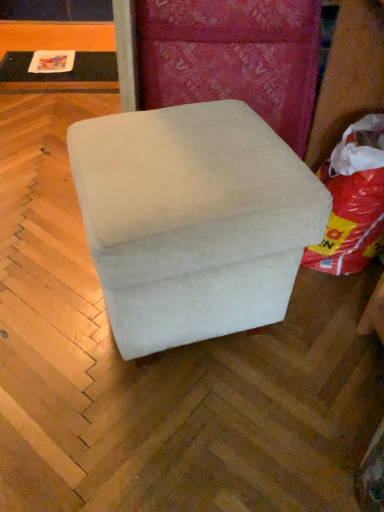
Based on the photo, measure the distance between white fabric ottoman at center and camera.

A distance of 24.57 inches exists between white fabric ottoman at center and camera.

This screenshot has width=384, height=512. Describe the element at coordinates (353, 201) in the screenshot. I see `white fabric bean bag at right` at that location.

Locate an element on the screen. white fabric ottoman at center is located at coordinates (193, 220).

Considering their positions, is matte black table at upper left located in front of or behind white fabric bean bag at right?

Visually, matte black table at upper left is located behind white fabric bean bag at right.

Find the location of a particular element. Image resolution: width=384 pixels, height=512 pixels. bean bag chair in front of the matte black table at upper left is located at coordinates (353, 201).

How different are the orientations of matte black table at upper left and white fabric bean bag at right in degrees?

The facing directions of matte black table at upper left and white fabric bean bag at right are 84 degrees apart.

From a real-world perspective, which is physically below, matte black table at upper left or white fabric bean bag at right?

matte black table at upper left, from a real-world perspective.

Considering the relative positions of matte black table at upper left and white fabric ottoman at center in the image provided, is matte black table at upper left to the right of white fabric ottoman at center from the viewer's perspective?

In fact, matte black table at upper left is to the left of white fabric ottoman at center.

In terms of size, does matte black table at upper left appear bigger or smaller than white fabric ottoman at center?

Clearly, matte black table at upper left is smaller in size than white fabric ottoman at center.

Which of these two, matte black table at upper left or white fabric ottoman at center, stands shorter?

matte black table at upper left is shorter.

Is white fabric ottoman at center inside or outside of white fabric bean bag at right?

white fabric ottoman at center cannot be found inside white fabric bean bag at right.

Considering the sizes of objects white fabric ottoman at center and white fabric bean bag at right in the image provided, who is wider, white fabric ottoman at center or white fabric bean bag at right?

white fabric ottoman at center is wider.

This screenshot has height=512, width=384. I want to click on furniture in front of the white fabric bean bag at right, so click(193, 220).

From a real-world perspective, is white fabric bean bag at right on top of white fabric ottoman at center?

Incorrect, from a real-world perspective, white fabric bean bag at right is lower than white fabric ottoman at center.

I want to click on furniture lying in front of the white fabric bean bag at right, so click(193, 220).

Considering the relative positions of white fabric bean bag at right and white fabric ottoman at center in the image provided, is white fabric bean bag at right to the left of white fabric ottoman at center from the viewer's perspective?

No, white fabric bean bag at right is not to the left of white fabric ottoman at center.

Is white fabric bean bag at right far away from white fabric ottoman at center?

No.

Considering the relative sizes of white fabric ottoman at center and matte black table at upper left in the image provided, is white fabric ottoman at center smaller than matte black table at upper left?

Incorrect, white fabric ottoman at center is not smaller in size than matte black table at upper left.

From a real-world perspective, which is physically above, white fabric ottoman at center or matte black table at upper left?

white fabric ottoman at center.

Considering the relative sizes of white fabric ottoman at center and matte black table at upper left in the image provided, is white fabric ottoman at center taller than matte black table at upper left?

Yes, white fabric ottoman at center is taller than matte black table at upper left.

Can you confirm if white fabric ottoman at center is thinner than matte black table at upper left?

Yes, white fabric ottoman at center is thinner than matte black table at upper left.

Which is more to the left, white fabric bean bag at right or matte black table at upper left?

Positioned to the left is matte black table at upper left.

Find the location of a particular element. This screenshot has height=512, width=384. bean bag chair below the matte black table at upper left (from the image's perspective) is located at coordinates (353, 201).

Would you say white fabric bean bag at right is a long distance from matte black table at upper left?

white fabric bean bag at right is positioned a significant distance from matte black table at upper left.

Is white fabric bean bag at right not inside matte black table at upper left?

white fabric bean bag at right lies outside matte black table at upper left's area.

At what (x,y) coordinates should I click in order to perform the action: click on bean bag chair above the matte black table at upper left (from a real-world perspective). Please return your answer as a coordinate pair (x, y). Looking at the image, I should click on coord(353,201).

Identify the location of table above the white fabric ottoman at center (from the image's perspective). The width and height of the screenshot is (384, 512). (60, 74).

Based on their spatial positions, is matte black table at upper left or white fabric ottoman at center further from white fabric bean bag at right?

Among the two, matte black table at upper left is located further to white fabric bean bag at right.

From the image, which object appears to be farther from matte black table at upper left, white fabric bean bag at right or white fabric ottoman at center?

Based on the image, white fabric ottoman at center appears to be further to matte black table at upper left.

From the image, which object appears to be farther from matte black table at upper left, white fabric ottoman at center or white fabric bean bag at right?

Based on the image, white fabric ottoman at center appears to be further to matte black table at upper left.

From the picture: From the image, which object appears to be farther from white fabric ottoman at center, matte black table at upper left or white fabric bean bag at right?

matte black table at upper left.

Looking at the image, which one is located closer to white fabric bean bag at right, white fabric ottoman at center or matte black table at upper left?

The object closer to white fabric bean bag at right is white fabric ottoman at center.

Considering their positions, is white fabric bean bag at right positioned closer to white fabric ottoman at center than matte black table at upper left?

Based on the image, white fabric bean bag at right appears to be nearer to white fabric ottoman at center.

This screenshot has width=384, height=512. Find the location of `bean bag chair between white fabric ottoman at center and matte black table at upper left in the front-back direction`. bean bag chair between white fabric ottoman at center and matte black table at upper left in the front-back direction is located at coordinates (353, 201).